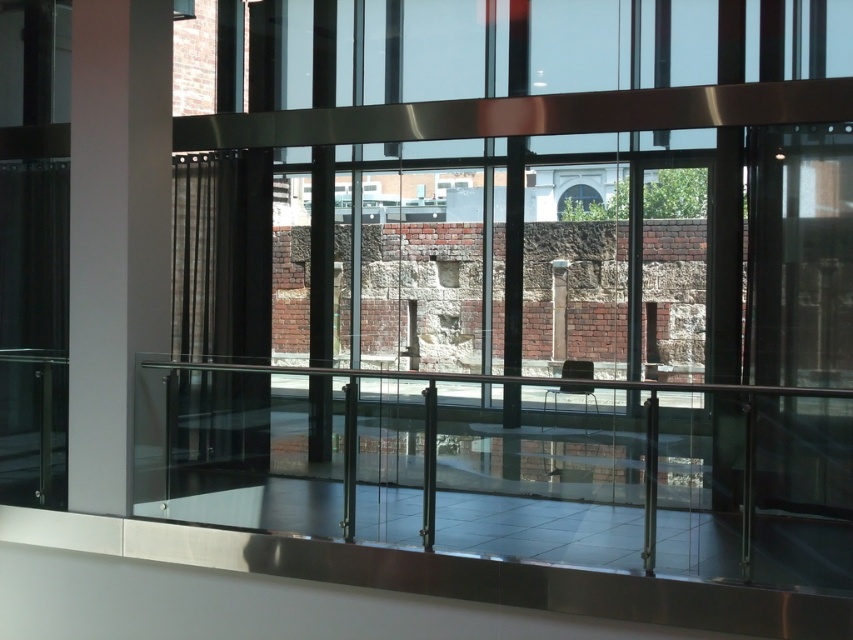
Question: Can you confirm if clear glass railing at center is smaller than smooth stone pillar at center?

Choices:
 (A) no
 (B) yes

Answer: (A)

Question: From the image, what is the correct spatial relationship of clear glass railing at center in relation to white glossy pillar at left?

Choices:
 (A) right
 (B) left

Answer: (A)

Question: Which of these objects is positioned farthest from the clear glass railing at center?

Choices:
 (A) smooth stone pillar at center
 (B) white glossy pillar at left

Answer: (B)

Question: Does clear glass railing at center have a smaller size compared to smooth stone pillar at center?

Choices:
 (A) yes
 (B) no

Answer: (B)

Question: Which is nearer to the white glossy pillar at left?

Choices:
 (A) smooth stone pillar at center
 (B) clear glass railing at center

Answer: (B)

Question: Which of the following is the closest to the observer?

Choices:
 (A) white glossy pillar at left
 (B) smooth stone pillar at center
 (C) clear glass railing at center

Answer: (C)